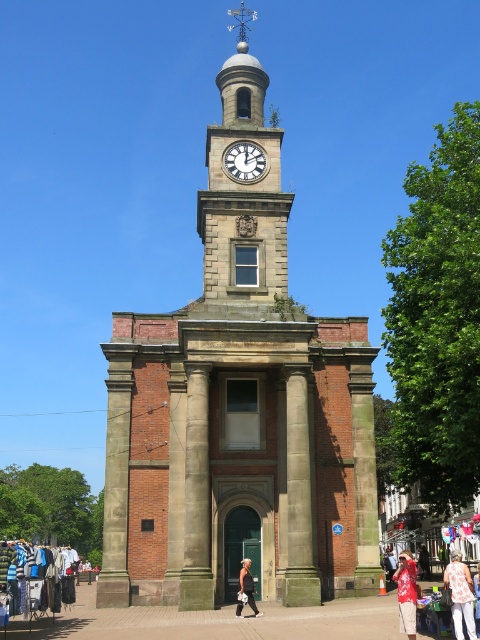
Is point (283, 300) positioned after point (250, 177)?

No, (283, 300) is in front of (250, 177).

The image size is (480, 640). Describe the element at coordinates (239, 410) in the screenshot. I see `brown stone clock tower at center` at that location.

Identify the location of brown stone clock tower at center. The height and width of the screenshot is (640, 480). (239, 410).

Can you confirm if white glossy clock at center is shorter than white cotton shirt at lower right?

Yes.

Between white glossy clock at center and white cotton shirt at lower right, which one is positioned higher?

white glossy clock at center

Describe the element at coordinates (244, 161) in the screenshot. I see `white glossy clock at center` at that location.

At what (x,y) coordinates should I click in order to perform the action: click on white glossy clock at center. Please return your answer as a coordinate pair (x, y). The image size is (480, 640). Looking at the image, I should click on tap(244, 161).

Is brown stone clock tower at center wider than white textured bag at center?

Yes, brown stone clock tower at center is wider than white textured bag at center.

Does brown stone clock tower at center have a greater height compared to white textured bag at center?

Indeed, brown stone clock tower at center has a greater height compared to white textured bag at center.

The width and height of the screenshot is (480, 640). Describe the element at coordinates (239, 410) in the screenshot. I see `brown stone clock tower at center` at that location.

This screenshot has width=480, height=640. Identify the location of brown stone clock tower at center. (239, 410).